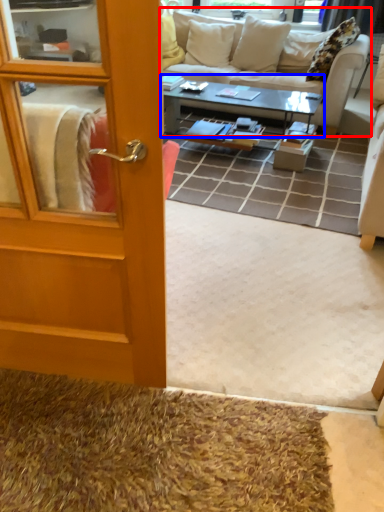
Question: Which object appears farthest to the camera in this image, studio couch (highlighted by a red box) or coffee table (highlighted by a blue box)?

Choices:
 (A) studio couch
 (B) coffee table

Answer: (A)